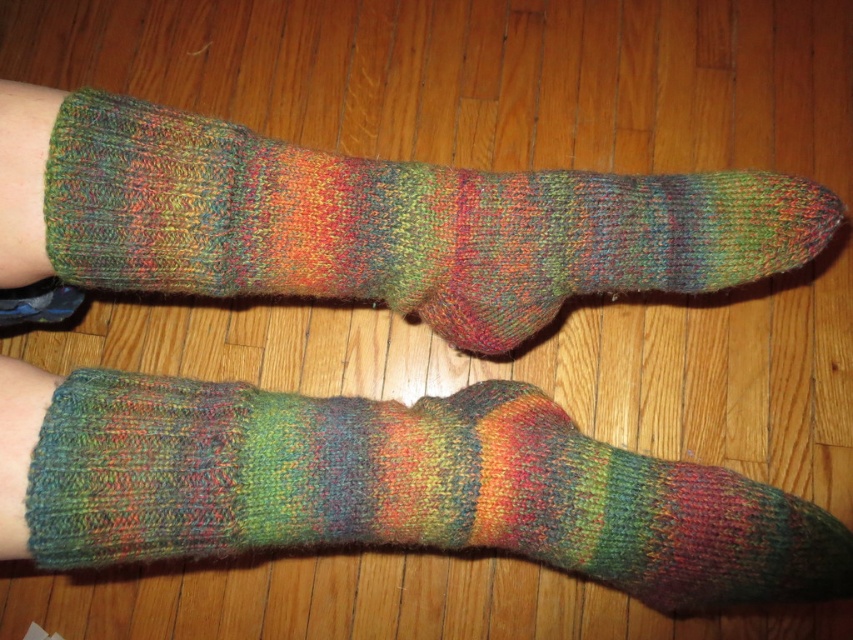
In the scene shown: Is multicolored knitted sock at lower left smaller than multicolored knitted sock at upper center?

Correct, multicolored knitted sock at lower left occupies less space than multicolored knitted sock at upper center.

Between multicolored knitted sock at lower left and multicolored knitted sock at upper center, which one is positioned lower?

multicolored knitted sock at lower left is below.

The width and height of the screenshot is (853, 640). In order to click on multicolored knitted sock at lower left in this screenshot , I will do `click(407, 488)`.

The height and width of the screenshot is (640, 853). I want to click on multicolored knitted sock at lower left, so click(x=407, y=488).